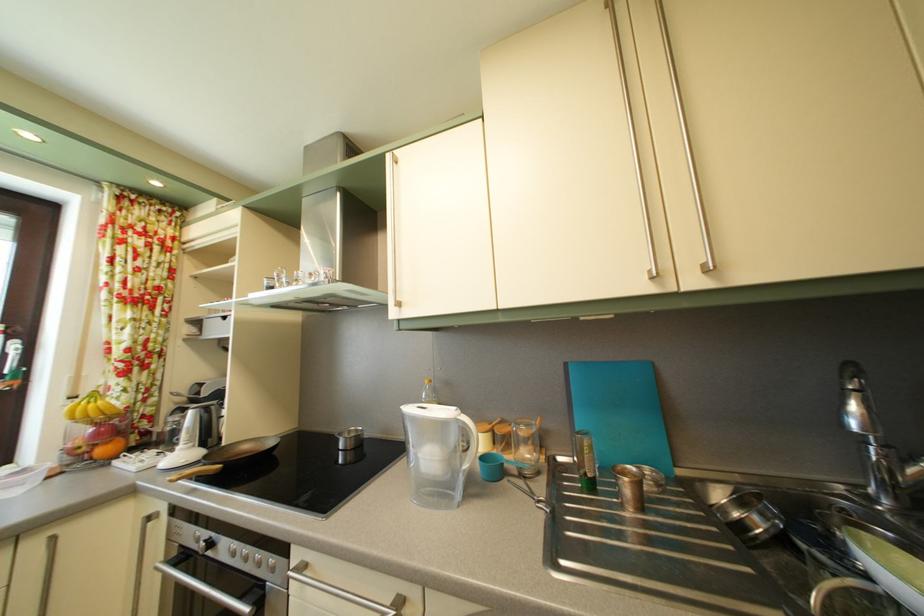
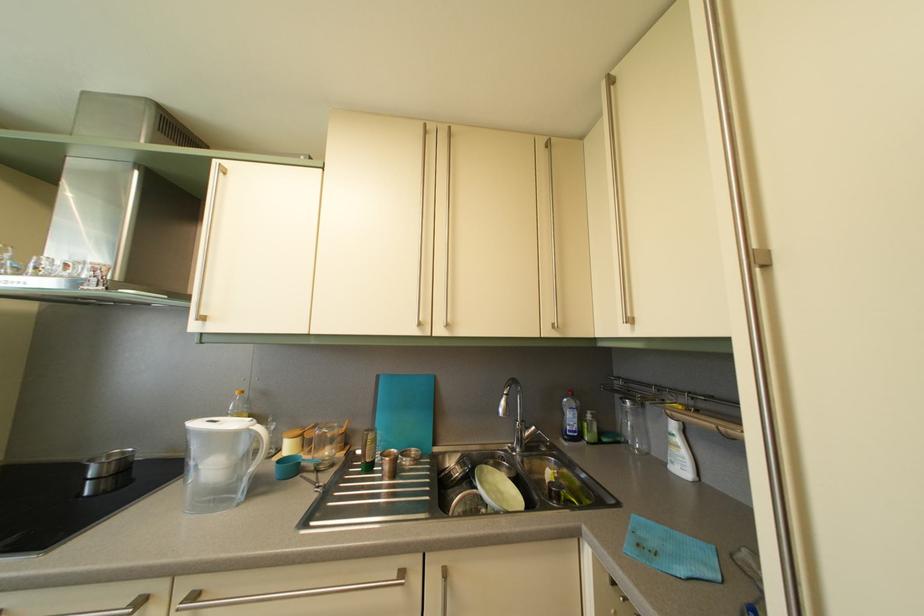
Find the pixel in the second image that matches point (472, 427) in the first image.

(266, 436)